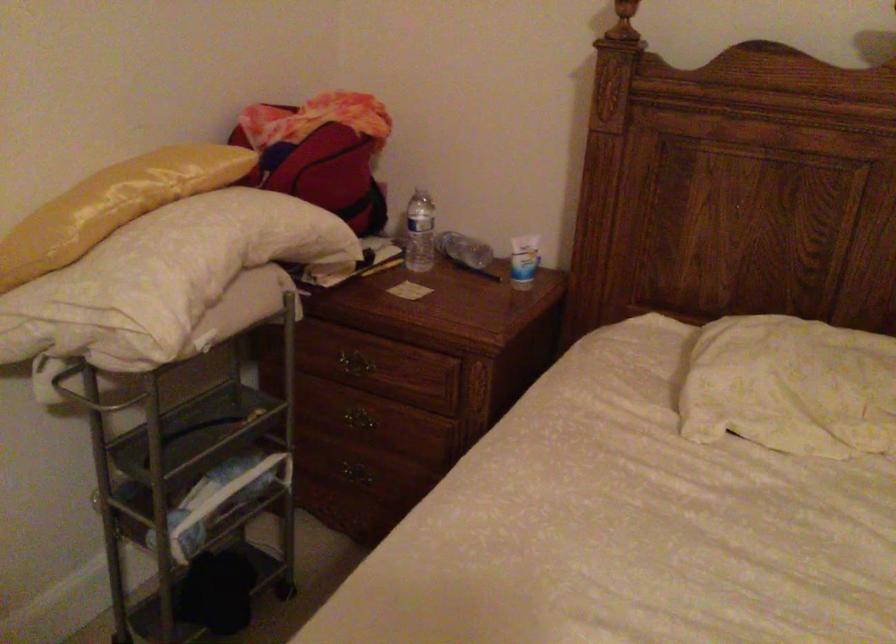
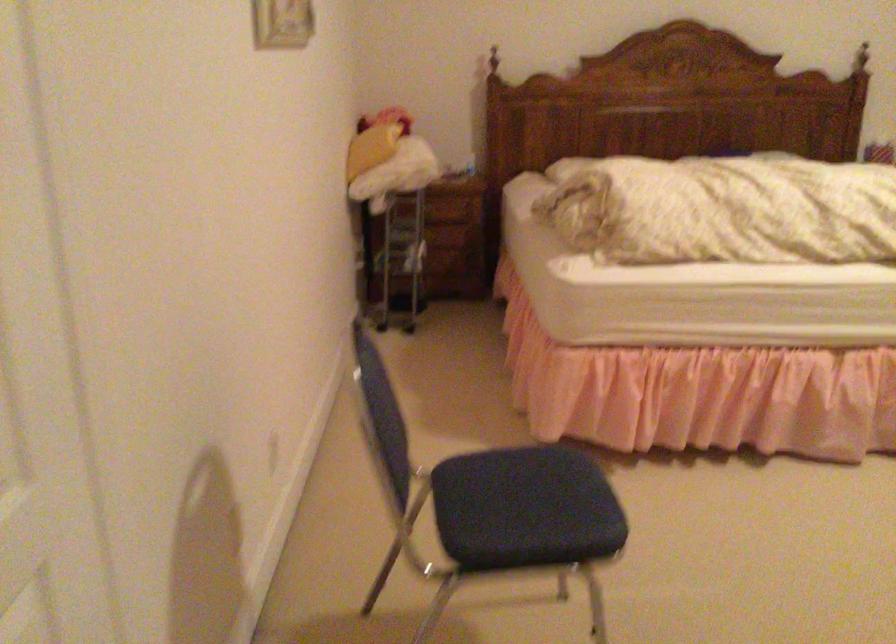
What movement of the cameraman would produce the second image?

The cameraman walked toward left, backward.